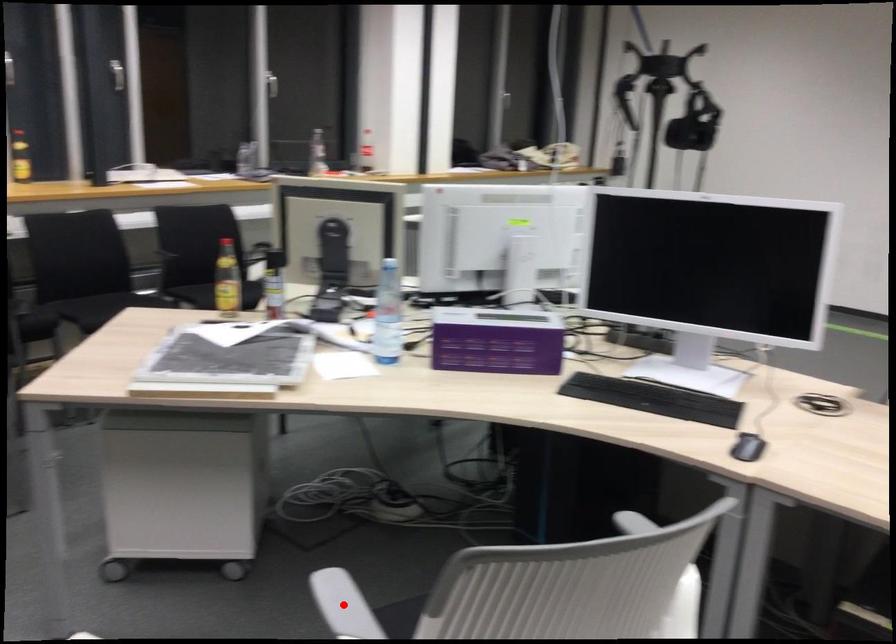
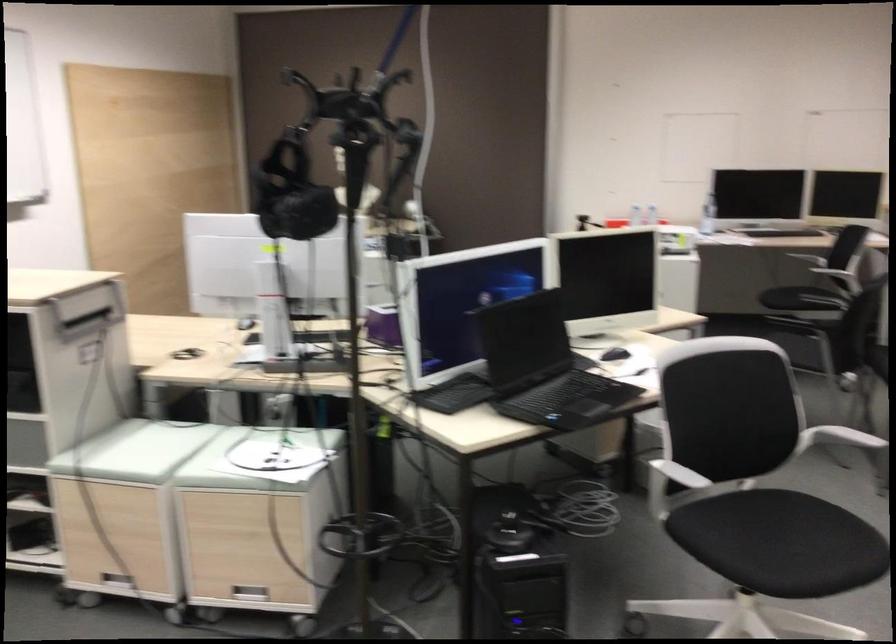
Question: I am providing you with two images of the same scene from different viewpoints. A red point is marked on the first image. Is the red point's position out of view in image 2?

Choices:
 (A) Yes
 (B) No

Answer: (A)